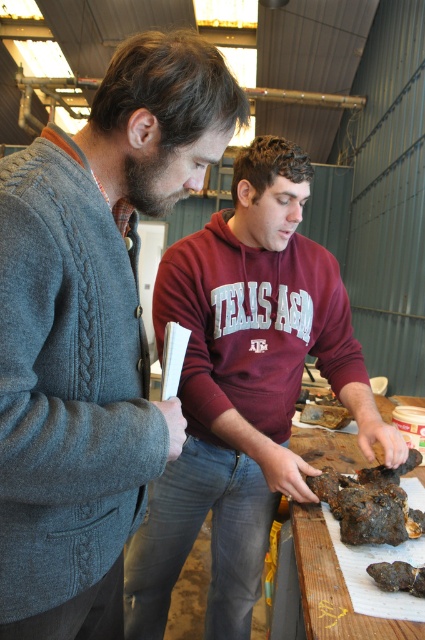
Question: Does wooden table at center appear under brown rough rock at lower center?

Choices:
 (A) no
 (B) yes

Answer: (A)

Question: Among these points, which one is nearest to the camera?

Choices:
 (A) (33, 349)
 (B) (299, 209)
 (C) (388, 419)
 (D) (399, 582)

Answer: (A)

Question: Can you confirm if maroon hoodie at center is positioned below wooden table at center?

Choices:
 (A) yes
 (B) no

Answer: (B)

Question: Does maroon hoodie at center have a smaller size compared to brown rough rock at lower center?

Choices:
 (A) no
 (B) yes

Answer: (A)

Question: Which point is closer to the camera taking this photo?

Choices:
 (A) (394, 561)
 (B) (152, 556)
 (C) (5, 180)
 (D) (337, 579)

Answer: (C)

Question: Which of the following is the closest to the observer?

Choices:
 (A) (408, 568)
 (B) (308, 589)

Answer: (B)